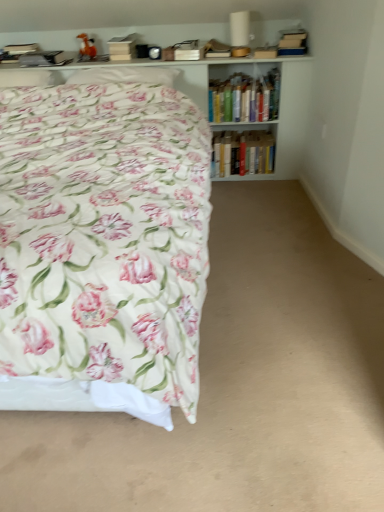
Question: Is hardcover books at upper right, placed as the second book when sorted from bottom to top, thinner than floral fabric bed at left?

Choices:
 (A) yes
 (B) no

Answer: (A)

Question: Would you say floral fabric bed at left is part of hardcover books at upper right, which appears as the first book when viewed from the top,'s contents?

Choices:
 (A) no
 (B) yes

Answer: (A)

Question: Is hardcover books at upper right, which appears as the first book when viewed from the top, shorter than floral fabric bed at left?

Choices:
 (A) yes
 (B) no

Answer: (A)

Question: Can you confirm if hardcover books at upper right, which appears as the first book when viewed from the top, is taller than floral fabric bed at left?

Choices:
 (A) yes
 (B) no

Answer: (B)

Question: Is the position of hardcover books at upper right, placed as the second book when sorted from bottom to top, more distant than that of floral fabric bed at left?

Choices:
 (A) yes
 (B) no

Answer: (A)

Question: In terms of size, does white glossy bookcase at upper center appear bigger or smaller than hardcover books at upper right, which appears as the first book when viewed from the top?

Choices:
 (A) small
 (B) big

Answer: (B)

Question: Visually, is white glossy bookcase at upper center positioned to the left or to the right of hardcover books at upper right, placed as the second book when sorted from bottom to top?

Choices:
 (A) right
 (B) left

Answer: (B)

Question: From their relative heights in the image, would you say white glossy bookcase at upper center is taller or shorter than hardcover books at upper right, placed as the second book when sorted from bottom to top?

Choices:
 (A) short
 (B) tall

Answer: (B)

Question: Considering the positions of point (180, 75) and point (271, 72), is point (180, 75) closer or farther from the camera than point (271, 72)?

Choices:
 (A) farther
 (B) closer

Answer: (A)

Question: From a real-world perspective, relative to floral fabric bed at left, is white glossy bookcase at upper center vertically above or below?

Choices:
 (A) below
 (B) above

Answer: (B)

Question: In the image, is white glossy bookcase at upper center on the left side or the right side of floral fabric bed at left?

Choices:
 (A) left
 (B) right

Answer: (B)

Question: Considering their positions, is white glossy bookcase at upper center located in front of or behind floral fabric bed at left?

Choices:
 (A) behind
 (B) front

Answer: (A)

Question: Considering the positions of white glossy bookcase at upper center and floral fabric bed at left in the image, is white glossy bookcase at upper center wider or thinner than floral fabric bed at left?

Choices:
 (A) thin
 (B) wide

Answer: (A)

Question: From the image's perspective, relative to hardcover books at upper right, placed as the second book when sorted from bottom to top, is floral fabric bed at left above or below?

Choices:
 (A) above
 (B) below

Answer: (B)

Question: Do you think floral fabric bed at left is within hardcover books at upper right, placed as the second book when sorted from bottom to top, or outside of it?

Choices:
 (A) outside
 (B) inside

Answer: (A)